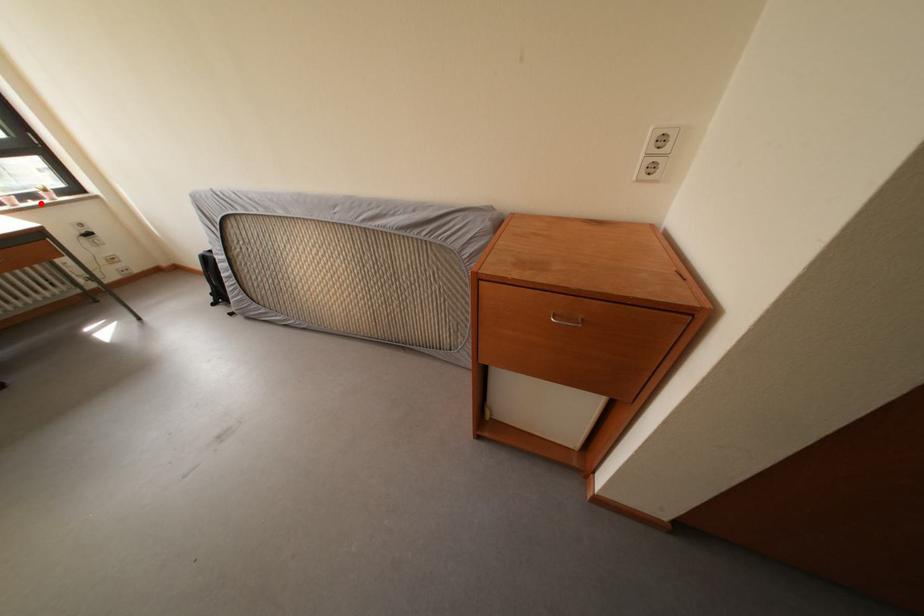
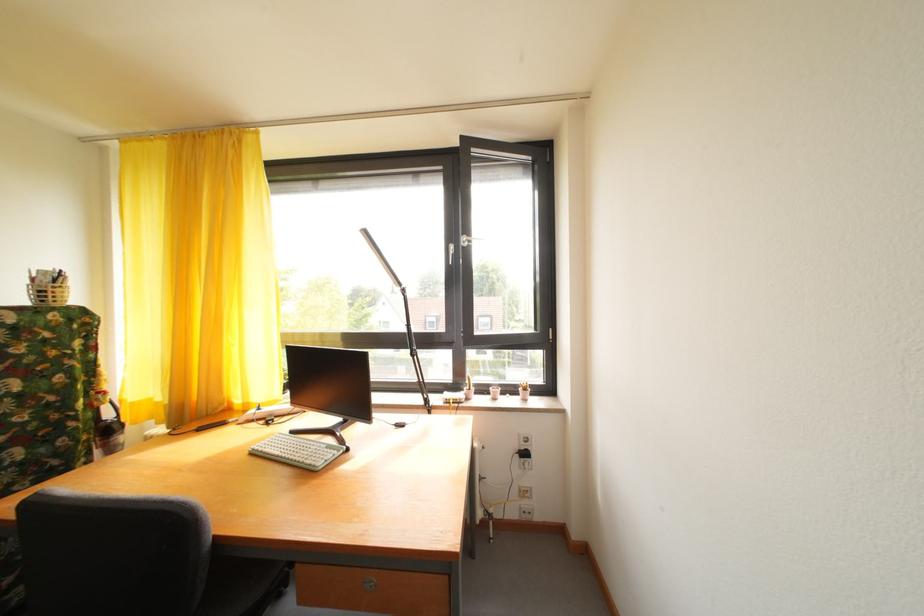
Question: I am providing you with two images of the same scene from different viewpoints. Given a red point in image1, look at the same physical point in image2. Is it:

Choices:
 (A) Closer to the viewpoint
 (B) Farther from the viewpoint

Answer: (A)